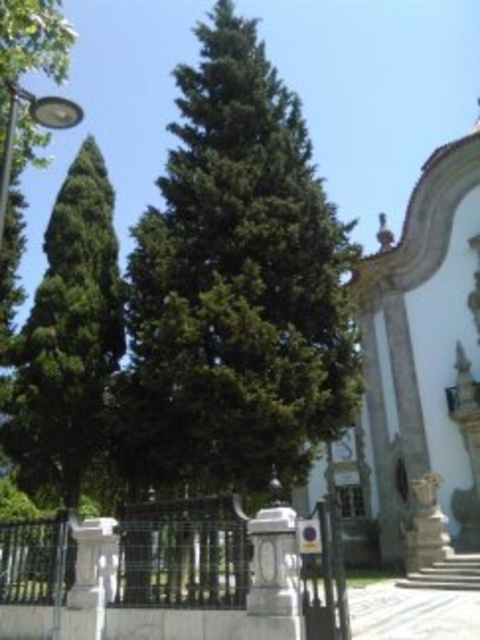
Who is lower down, green leafy tree at center or green leafy tree at left?

Positioned lower is green leafy tree at left.

Is green leafy tree at center below green leafy tree at left?

No.

At what (x,y) coordinates should I click in order to perform the action: click on green leafy tree at center. Please return your answer as a coordinate pair (x, y). Looking at the image, I should click on (235, 288).

Locate an element on the screen. green leafy tree at center is located at coordinates (235, 288).